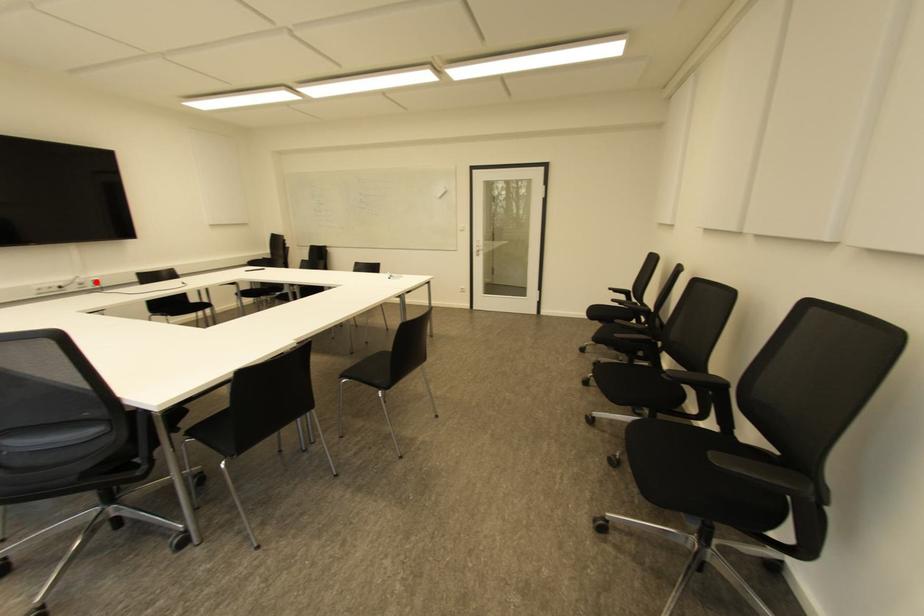
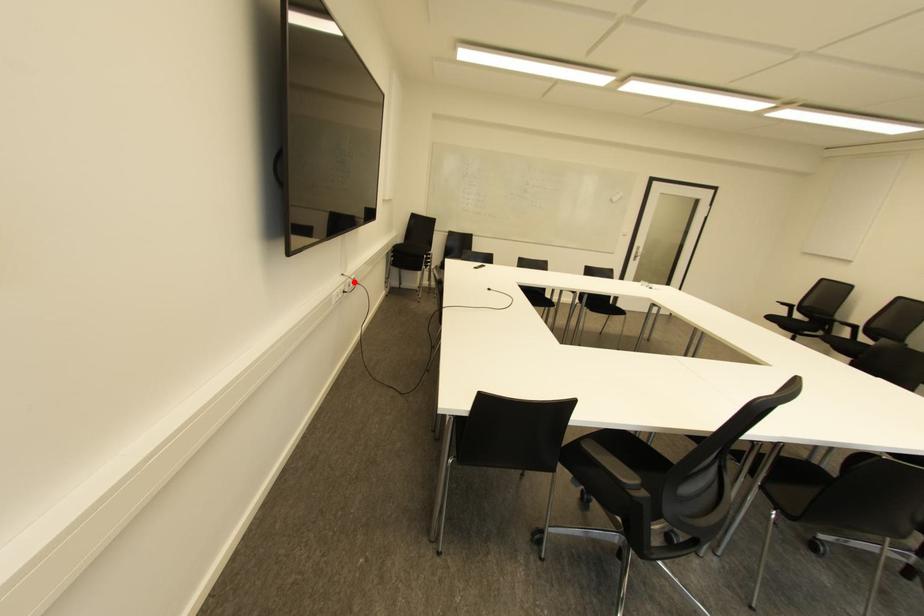
I am providing you with two images of the same scene from different viewpoints. A red point is marked on the first image and another point is marked on the second image. Are the points marked in image1 and image2 representing the same 3D position?

Yes